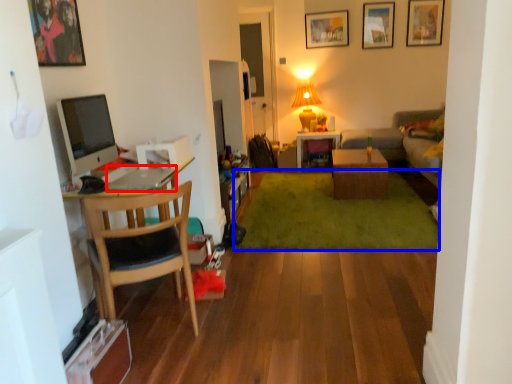
Question: Which object is closer to the camera taking this photo, laptop (highlighted by a red box) or plain (highlighted by a blue box)?

Choices:
 (A) laptop
 (B) plain

Answer: (A)